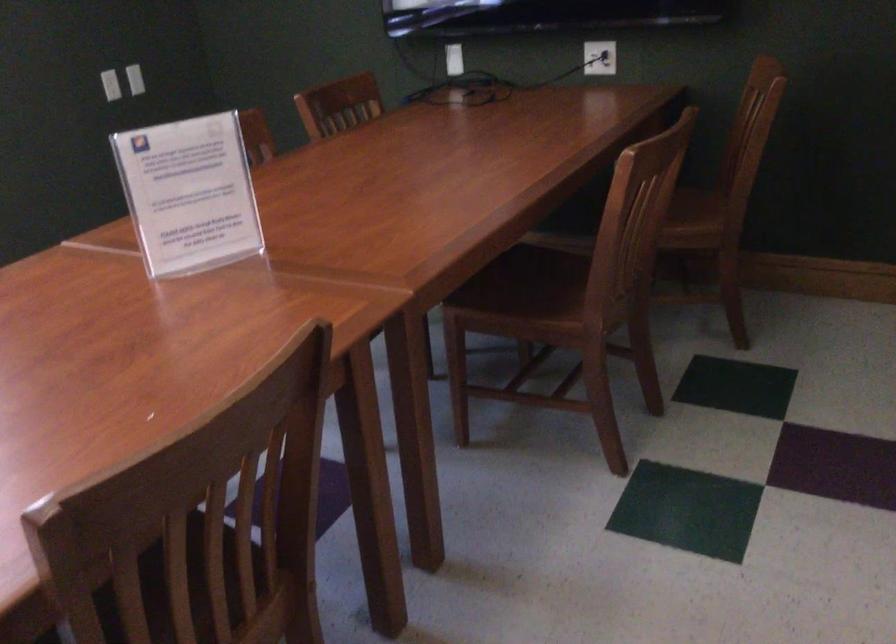
This screenshot has width=896, height=644. Find the location of `clear sign holder`. clear sign holder is located at coordinates (188, 194).